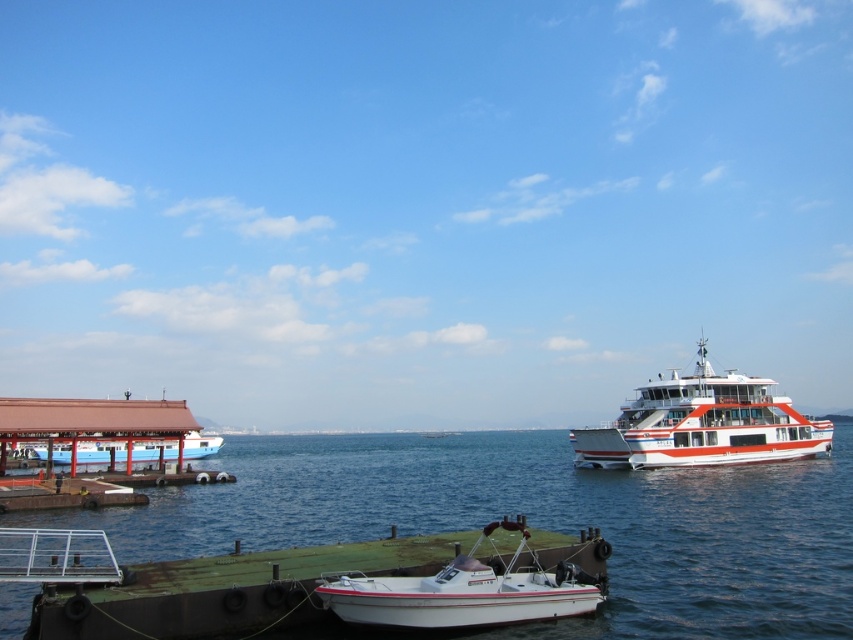
Question: Does green matte water at lower left have a larger size compared to white glossy ferry at right?

Choices:
 (A) no
 (B) yes

Answer: (B)

Question: Based on their relative distances, which object is nearer to the white glossy boat at center?

Choices:
 (A) white glossy ferry at right
 (B) green matte water at lower left
 (C) light blue wooden dock at left

Answer: (A)

Question: Which of these objects is positioned closest to the light blue wooden dock at left?

Choices:
 (A) white glossy boat at center
 (B) white glossy ferry at right

Answer: (B)

Question: Which point is closer to the camera?

Choices:
 (A) (38, 452)
 (B) (722, 417)

Answer: (B)

Question: Can you confirm if green matte water at lower left is thinner than white glossy ferry at right?

Choices:
 (A) yes
 (B) no

Answer: (B)

Question: Is green matte water at lower left wider than white glossy ferry at right?

Choices:
 (A) no
 (B) yes

Answer: (B)